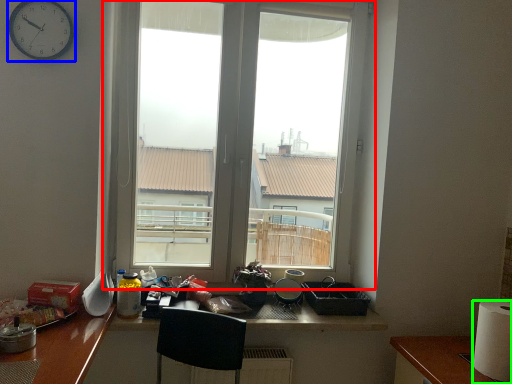
Question: Which object is the closest to the window (highlighted by a red box)? Choose among these: clock (highlighted by a blue box) or paper towel (highlighted by a green box).

Choices:
 (A) clock
 (B) paper towel

Answer: (A)